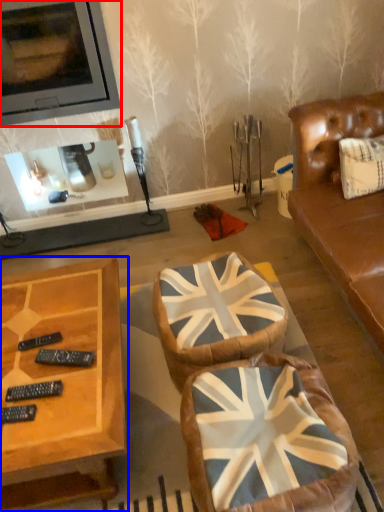
Question: Which object is further to the camera taking this photo, picture frame (highlighted by a red box) or coffee table (highlighted by a blue box)?

Choices:
 (A) picture frame
 (B) coffee table

Answer: (A)